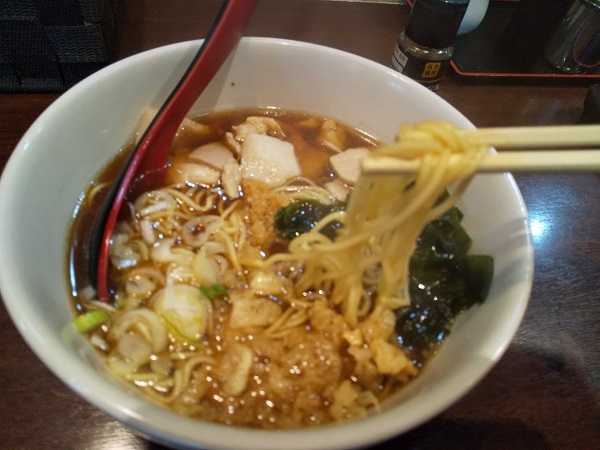
Find the location of a particular element. chopsticks is located at coordinates (548, 165), (540, 137).